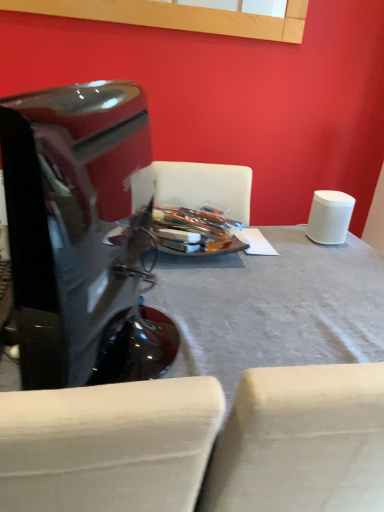
Locate an element on the screen. The height and width of the screenshot is (512, 384). glossy black monitor at left is located at coordinates (82, 234).

This screenshot has width=384, height=512. Describe the element at coordinates (82, 234) in the screenshot. I see `glossy black monitor at left` at that location.

Measure the distance between glossy black monitor at left and camera.

The distance of glossy black monitor at left from camera is 27.68 inches.

The width and height of the screenshot is (384, 512). What do you see at coordinates (273, 307) in the screenshot?
I see `white fabric table at center` at bounding box center [273, 307].

You are a GUI agent. You are given a task and a screenshot of the screen. Output one action in this format:
    pyautogui.click(x=<x>, y=<y>)
    Task: Click on the white fabric table at center
    The width and height of the screenshot is (384, 512).
    Given the screenshot: What is the action you would take?
    pyautogui.click(x=273, y=307)

Locate an element on the screen. Image resolution: width=384 pixels, height=512 pixels. glossy black monitor at left is located at coordinates (82, 234).

Is white fabric table at center to the left or to the right of glossy black monitor at left in the image?

Clearly, white fabric table at center is on the right of glossy black monitor at left in the image.

In the image, is white fabric table at center positioned in front of or behind glossy black monitor at left?

In the image, white fabric table at center appears behind glossy black monitor at left.

Does point (331, 341) appear closer or farther from the camera than point (10, 156)?

Point (331, 341).

From the image's perspective, who appears lower, white fabric table at center or glossy black monitor at left?

white fabric table at center.

From a real-world perspective, between white fabric table at center and glossy black monitor at left, who is vertically lower?

white fabric table at center is physically lower.

Does white fabric table at center have a lesser width compared to glossy black monitor at left?

Incorrect, the width of white fabric table at center is not less than that of glossy black monitor at left.

Considering the relative sizes of white fabric table at center and glossy black monitor at left in the image provided, is white fabric table at center taller than glossy black monitor at left?

Yes, white fabric table at center is taller than glossy black monitor at left.

Can you confirm if white fabric table at center is smaller than glossy black monitor at left?

Incorrect, white fabric table at center is not smaller in size than glossy black monitor at left.

Is white fabric table at center positioned beyond the bounds of glossy black monitor at left?

white fabric table at center is positioned outside glossy black monitor at left.

Can you see white fabric table at center touching glossy black monitor at left?

white fabric table at center is not next to glossy black monitor at left, and they're not touching.

Is white fabric table at center oriented away from glossy black monitor at left?

No, white fabric table at center is not facing away from glossy black monitor at left.

You are a GUI agent. You are given a task and a screenshot of the screen. Output one action in this format:
    pyautogui.click(x=<x>, y=<y>)
    Task: Click on the table lying below the glossy black monitor at left (from the image's perspective)
    Image resolution: width=384 pixels, height=512 pixels.
    Given the screenshot: What is the action you would take?
    pos(273,307)

Which object is positioned more to the left, glossy black monitor at left or white fabric table at center?

From the viewer's perspective, glossy black monitor at left appears more on the left side.

Considering their positions, is glossy black monitor at left located in front of or behind white fabric table at center?

glossy black monitor at left is positioned closer to the viewer than white fabric table at center.

Does point (65, 98) come closer to viewer compared to point (226, 377)?

No, (65, 98) is further to viewer.

From the image's perspective, which is above, glossy black monitor at left or white fabric table at center?

glossy black monitor at left.

From a real-world perspective, is glossy black monitor at left physically below white fabric table at center?

No, from a real-world perspective, glossy black monitor at left is not below white fabric table at center.

Between glossy black monitor at left and white fabric table at center, which one has larger width?

white fabric table at center is wider.

Based on the photo, considering the relative sizes of glossy black monitor at left and white fabric table at center in the image provided, is glossy black monitor at left taller than white fabric table at center?

No.

Is glossy black monitor at left smaller than white fabric table at center?

Yes.

Does glossy black monitor at left contain white fabric table at center?

Actually, white fabric table at center is outside glossy black monitor at left.

Is there a large distance between glossy black monitor at left and white fabric table at center?

No, glossy black monitor at left is not far away from white fabric table at center.

Could you tell me if glossy black monitor at left is facing white fabric table at center?

No, glossy black monitor at left is not aimed at white fabric table at center.

This screenshot has height=512, width=384. Identify the location of table beneath the glossy black monitor at left (from a real-world perspective). (273, 307).

At what (x,y) coordinates should I click in order to perform the action: click on table that appears below the glossy black monitor at left (from the image's perspective). Please return your answer as a coordinate pair (x, y). This screenshot has width=384, height=512. Looking at the image, I should click on (273, 307).

You are a GUI agent. You are given a task and a screenshot of the screen. Output one action in this format:
    pyautogui.click(x=<x>, y=<y>)
    Task: Click on the table behind the glossy black monitor at left
    This screenshot has height=512, width=384.
    Given the screenshot: What is the action you would take?
    pyautogui.click(x=273, y=307)